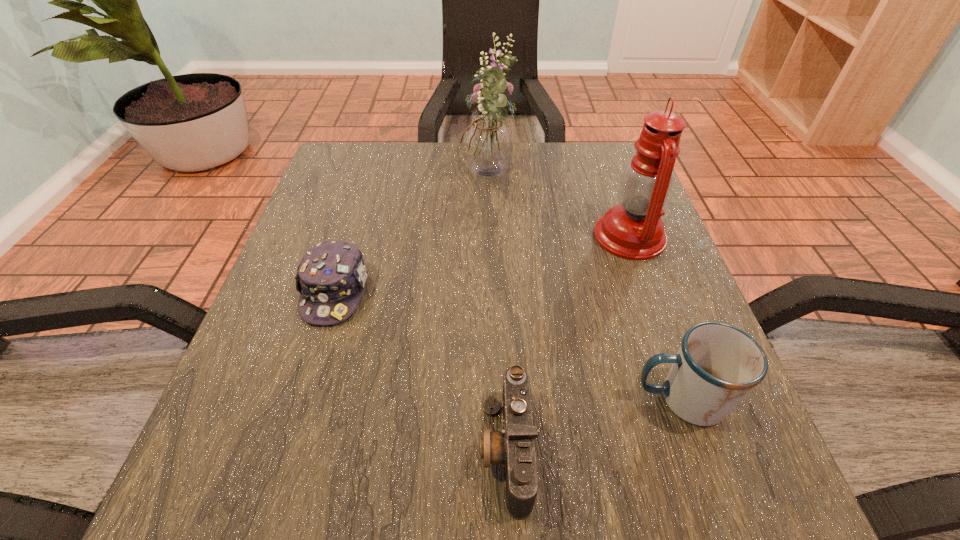
Locate an element on the screen. This screenshot has width=960, height=540. bouquet is located at coordinates (487, 143).

Where is `oil lamp`? oil lamp is located at coordinates click(634, 230).

In order to click on the third shortest object in this screenshot , I will do `click(717, 365)`.

Locate an element on the screen. camera is located at coordinates (514, 447).

Locate an element on the screen. the leftmost object is located at coordinates (330, 278).

The image size is (960, 540). I want to click on free location located 0.310m on the front-facing side of the farthest object, so pyautogui.click(x=329, y=179).

Locate an element on the screen. free space located on the front-facing side of the farthest object is located at coordinates (367, 179).

At what (x,y) coordinates should I click in order to perform the action: click on vacant area situated 0.120m on the front-facing side of the farthest object. Please return your answer as a coordinate pair (x, y). This screenshot has width=960, height=540. Looking at the image, I should click on (410, 179).

Where is `vacant space located on the left of the oil lamp`? The image size is (960, 540). vacant space located on the left of the oil lamp is located at coordinates (516, 236).

I want to click on free space located on the handle side of the third shortest object, so click(x=407, y=399).